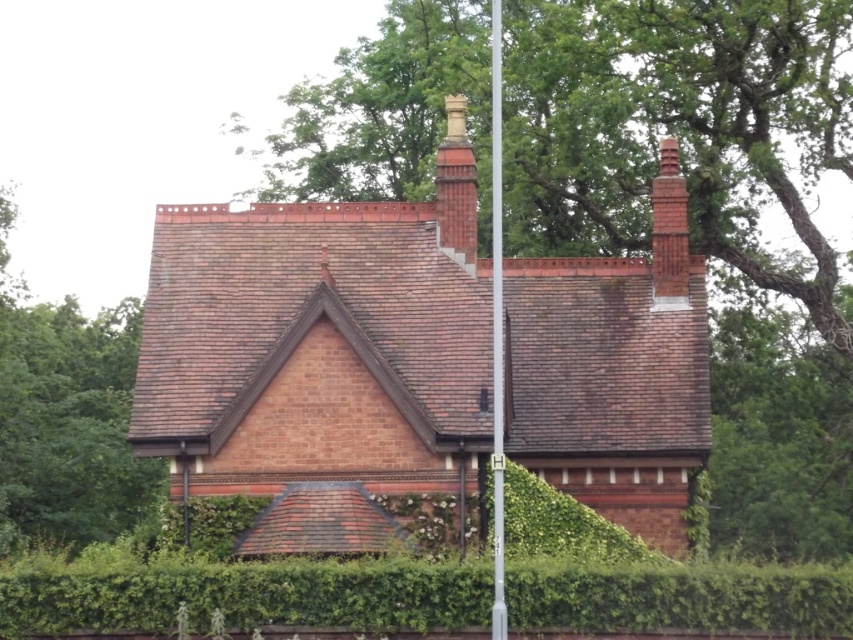
Question: Which is farther from the brown shingles at left?

Choices:
 (A) red brick chimney at upper right
 (B) green leafy tree at upper center
 (C) green leafy hedge at lower center

Answer: (C)

Question: Which point appears farthest from the camera in this image?

Choices:
 (A) tap(258, 620)
 (B) tap(657, 209)
 (C) tap(106, 464)
 (D) tap(492, 64)

Answer: (C)

Question: In this image, where is green leafy tree at upper center located relative to smooth brick chimney at center?

Choices:
 (A) left
 (B) right

Answer: (B)

Question: Is green leafy tree at upper center wider than red brick chimney at upper right?

Choices:
 (A) no
 (B) yes

Answer: (B)

Question: Which object appears farthest from the camera in this image?

Choices:
 (A) green leafy tree at upper center
 (B) brown shingles at left
 (C) smooth brick chimney at center

Answer: (A)

Question: In this image, where is green leafy tree at upper center located relative to metallic silver flag pole at center?

Choices:
 (A) below
 (B) above

Answer: (B)